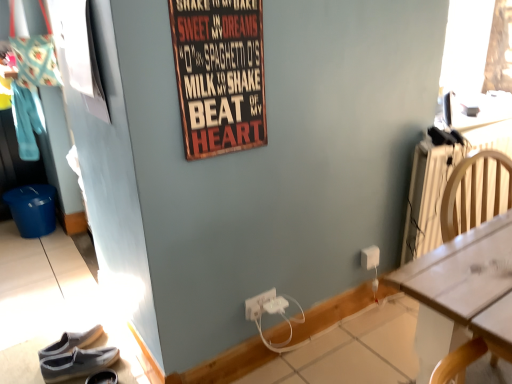
Question: Is gray fabric shoe at lower left, the first footwear viewed from the right, thinner than wooden signboard at upper center?

Choices:
 (A) no
 (B) yes

Answer: (A)

Question: Is the position of gray fabric shoe at lower left, the 2th footwear in the left-to-right sequence, less distant than that of wooden signboard at upper center?

Choices:
 (A) no
 (B) yes

Answer: (A)

Question: From a real-world perspective, is gray fabric shoe at lower left, the 2th footwear in the left-to-right sequence, located beneath wooden signboard at upper center?

Choices:
 (A) no
 (B) yes

Answer: (B)

Question: Is gray fabric shoe at lower left, the 2th footwear in the left-to-right sequence, surrounding wooden signboard at upper center?

Choices:
 (A) no
 (B) yes

Answer: (A)

Question: Does gray fabric shoe at lower left, the 2th footwear in the left-to-right sequence, have a greater height compared to wooden signboard at upper center?

Choices:
 (A) yes
 (B) no

Answer: (B)

Question: Is gray fabric shoe at lower left, the first footwear viewed from the right, shorter than wooden signboard at upper center?

Choices:
 (A) yes
 (B) no

Answer: (A)

Question: Is white plastic power outlet at lower center, placed as the second power outlet when sorted from front to back, taller than wooden signboard at upper center?

Choices:
 (A) yes
 (B) no

Answer: (B)

Question: Is white plastic power outlet at lower center, the 3th power outlet viewed from the right, far away from wooden signboard at upper center?

Choices:
 (A) yes
 (B) no

Answer: (B)

Question: Does white plastic power outlet at lower center, the first power outlet viewed from the left, have a lesser width compared to wooden signboard at upper center?

Choices:
 (A) no
 (B) yes

Answer: (B)

Question: Is white plastic power outlet at lower center, the first power outlet viewed from the left, completely or partially outside of wooden signboard at upper center?

Choices:
 (A) yes
 (B) no

Answer: (A)

Question: Is white plastic power outlet at lower center, arranged as the 2th power outlet when viewed from the back, oriented towards wooden signboard at upper center?

Choices:
 (A) no
 (B) yes

Answer: (A)

Question: Is white plastic power outlet at lower center, the first power outlet viewed from the left, at the right side of wooden signboard at upper center?

Choices:
 (A) yes
 (B) no

Answer: (A)

Question: Considering the relative sizes of wooden signboard at upper center and white plastic power outlet at lower center, the third power outlet in the back-to-front sequence, in the image provided, is wooden signboard at upper center thinner than white plastic power outlet at lower center, the third power outlet in the back-to-front sequence,?

Choices:
 (A) yes
 (B) no

Answer: (A)